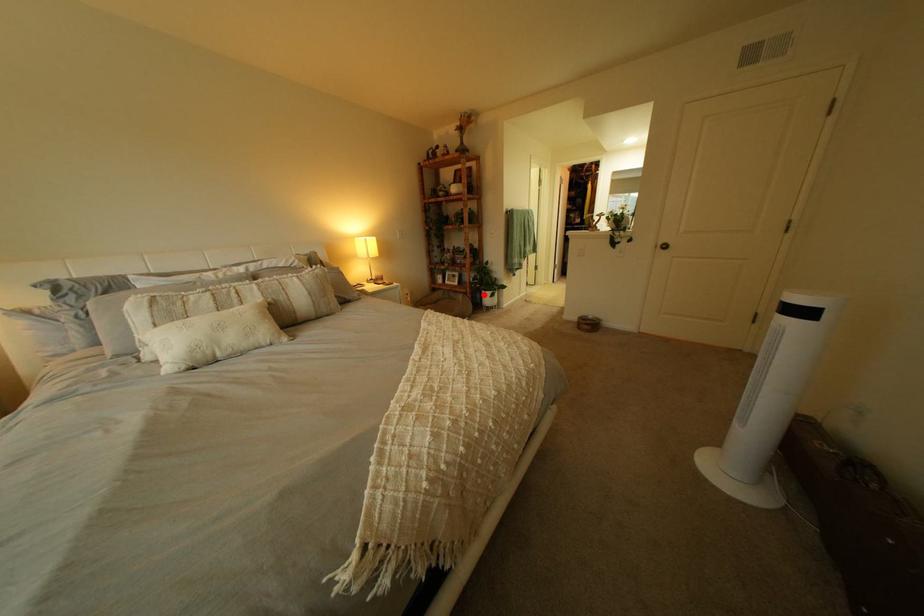
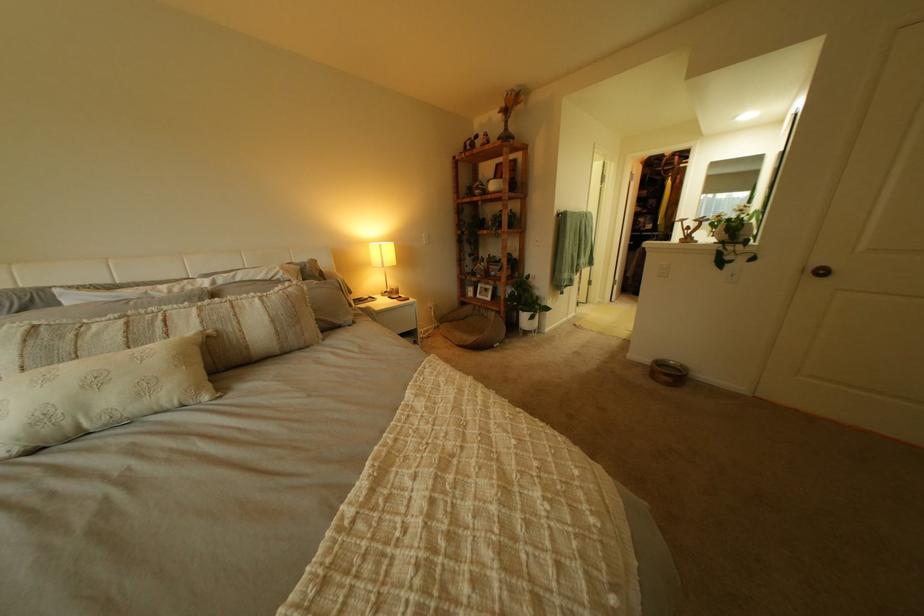
Locate, in the second image, the point that corresponds to the highlighted location in the first image.

(517, 314)